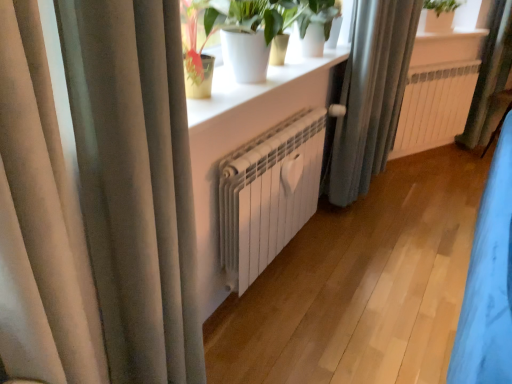
At what (x,y) coordinates should I click in order to perform the action: click on empty space that is to the right of gray fabric curtain at center, which ranks as the second curtain in front-to-back order. Please return your answer as a coordinate pair (x, y). The image size is (512, 384). Looking at the image, I should click on (391, 209).